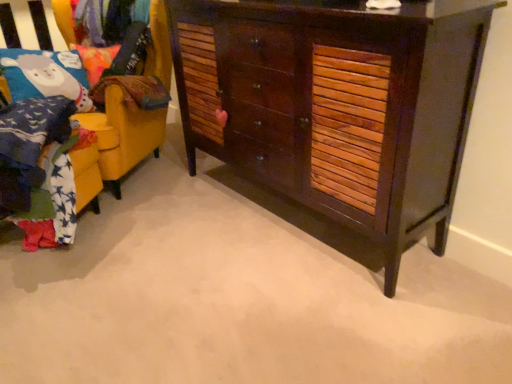
Question: From a real-world perspective, is dark wood cabinet at center below velvet fabric pillow at upper left?

Choices:
 (A) yes
 (B) no

Answer: (A)

Question: Is dark wood cabinet at center aimed at velvet fabric pillow at upper left?

Choices:
 (A) no
 (B) yes

Answer: (A)

Question: From the image's perspective, is dark wood cabinet at center on top of velvet fabric pillow at upper left?

Choices:
 (A) no
 (B) yes

Answer: (A)

Question: Is dark wood cabinet at center oriented away from velvet fabric pillow at upper left?

Choices:
 (A) yes
 (B) no

Answer: (B)

Question: Is dark wood cabinet at center behind velvet fabric pillow at upper left?

Choices:
 (A) no
 (B) yes

Answer: (A)

Question: Is point (365, 167) closer or farther from the camera than point (129, 104)?

Choices:
 (A) closer
 (B) farther

Answer: (A)

Question: From the image's perspective, is dark wood cabinet at center positioned above or below yellow fabric chair at left?

Choices:
 (A) below
 (B) above

Answer: (A)

Question: Is dark wood cabinet at center wider or thinner than yellow fabric chair at left?

Choices:
 (A) thin
 (B) wide

Answer: (A)

Question: Is dark wood cabinet at center in front of or behind yellow fabric chair at left in the image?

Choices:
 (A) behind
 (B) front

Answer: (B)

Question: From a real-world perspective, is velvet fabric pillow at upper left physically located above or below dark wood cabinet at center?

Choices:
 (A) below
 (B) above

Answer: (B)

Question: Does point (79, 16) appear closer or farther from the camera than point (456, 62)?

Choices:
 (A) farther
 (B) closer

Answer: (A)

Question: Choose the correct answer: Is velvet fabric pillow at upper left inside dark wood cabinet at center or outside it?

Choices:
 (A) outside
 (B) inside

Answer: (A)

Question: Is velvet fabric pillow at upper left taller or shorter than dark wood cabinet at center?

Choices:
 (A) short
 (B) tall

Answer: (A)

Question: Is point (104, 163) positioned closer to the camera than point (84, 6)?

Choices:
 (A) closer
 (B) farther

Answer: (A)

Question: From the image's perspective, relative to velvet fabric pillow at upper left, is yellow fabric chair at left above or below?

Choices:
 (A) above
 (B) below

Answer: (B)